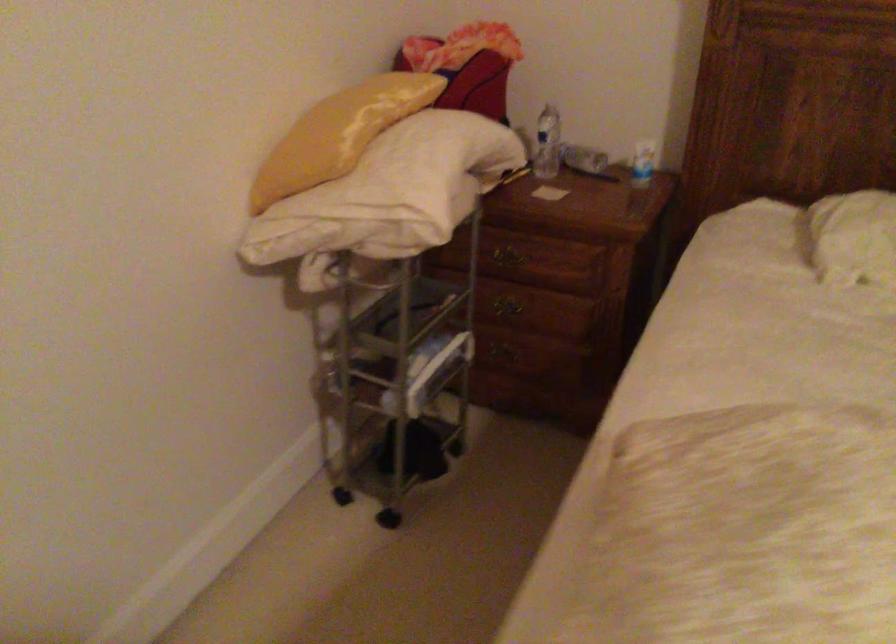
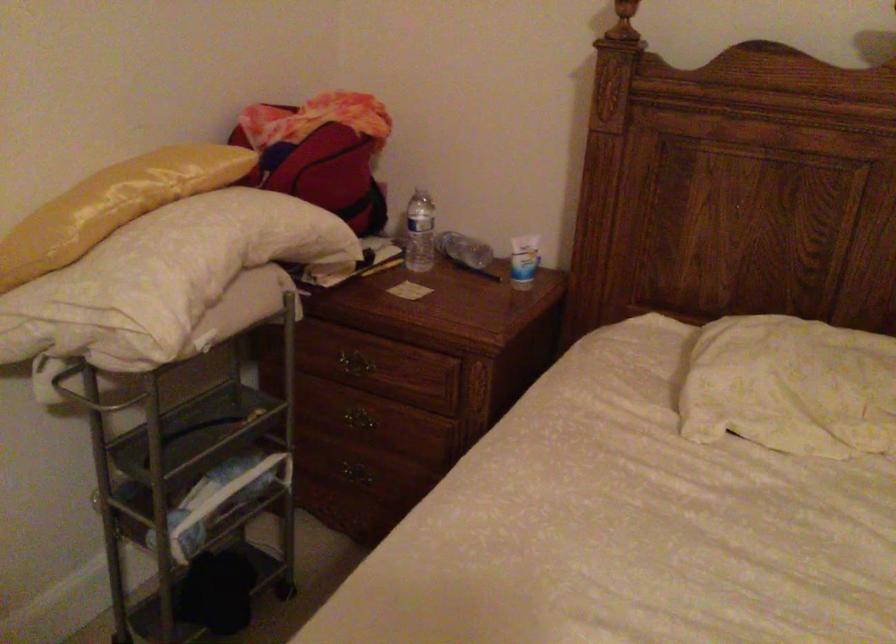
Question: The first image is from the beginning of the video and the second image is from the end. How did the camera likely rotate when shooting the video?

Choices:
 (A) Left
 (B) Right
 (C) Up
 (D) Down

Answer: (C)